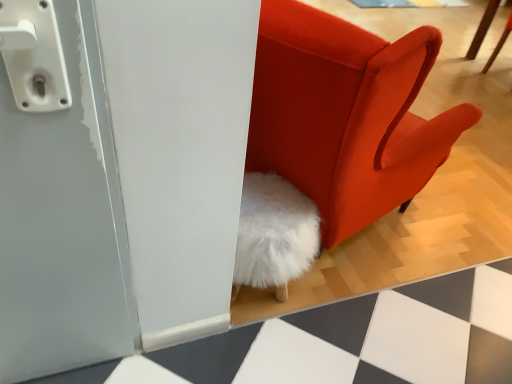
I want to click on vacant region to the left of white fluffy chair at upper right, so click(458, 73).